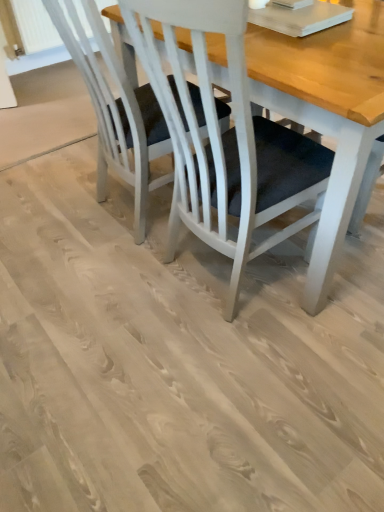
You are a GUI agent. You are given a task and a screenshot of the screen. Output one action in this format:
    pyautogui.click(x=<x>, y=<y>)
    Task: Click on the vacant space situated on the left part of wooden table at center
    The height and width of the screenshot is (512, 384).
    Given the screenshot: What is the action you would take?
    pyautogui.click(x=101, y=300)